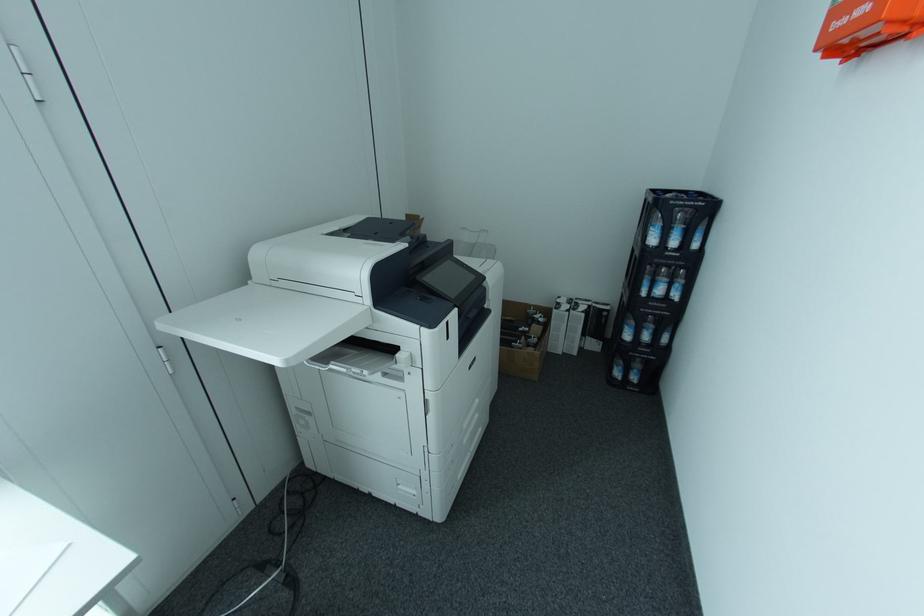
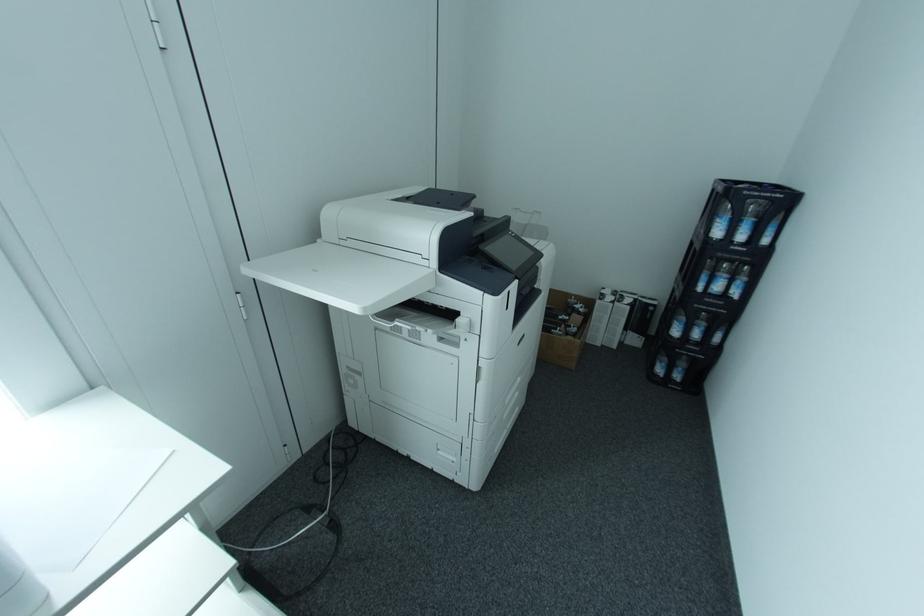
Question: Which direction would the cameraman need to move to produce the second image? Reply with the corresponding letter.

Choices:
 (A) Left
 (B) Right
 (C) Forward
 (D) Backward

Answer: (A)